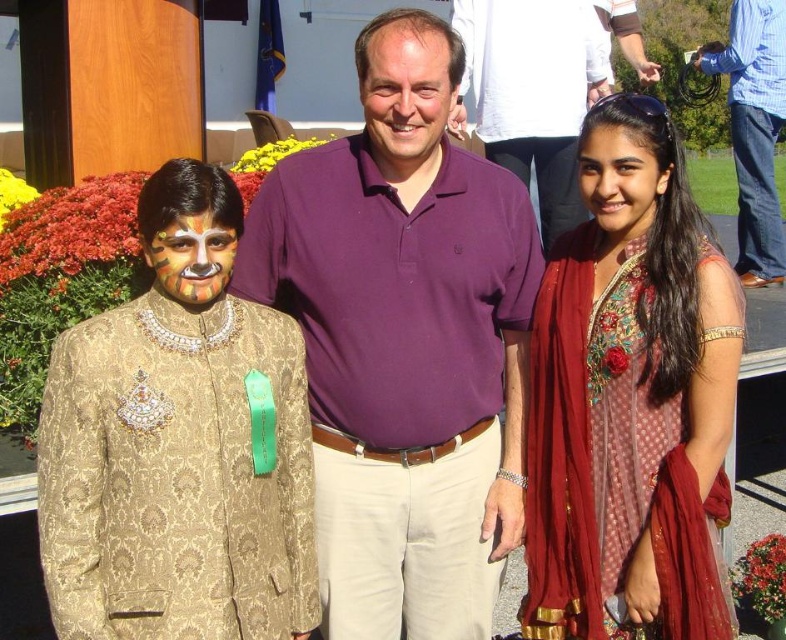
Does gold brocade sherwani at left have a greater width compared to purple cotton shirt at center?

No.

Can you confirm if gold brocade sherwani at left is positioned above purple cotton shirt at center?

No, gold brocade sherwani at left is not above purple cotton shirt at center.

Locate an element on the screen. gold brocade sherwani at left is located at coordinates (178, 444).

Between point (425, 625) and point (564, 125), which one is positioned in front?

Point (425, 625) is more forward.

Is purple cotton polo shirt at center to the right of purple cotton shirt at center from the viewer's perspective?

Incorrect, purple cotton polo shirt at center is not on the right side of purple cotton shirt at center.

Does point (299, 204) lie in front of point (545, 3)?

That is True.

Locate an element on the screen. This screenshot has height=640, width=786. purple cotton polo shirt at center is located at coordinates (403, 342).

Looking at this image, does purple smooth shirt at center have a greater height compared to smooth skin face at center?

Yes, purple smooth shirt at center is taller than smooth skin face at center.

Does purple smooth shirt at center appear over smooth skin face at center?

Indeed, purple smooth shirt at center is positioned over smooth skin face at center.

Between point (439, 116) and point (621, 204), which one is positioned in front?

Point (439, 116) is in front.

You are a GUI agent. You are given a task and a screenshot of the screen. Output one action in this format:
    pyautogui.click(x=<x>, y=<y>)
    Task: Click on the purple smooth shirt at center
    
    Given the screenshot: What is the action you would take?
    pyautogui.click(x=406, y=93)